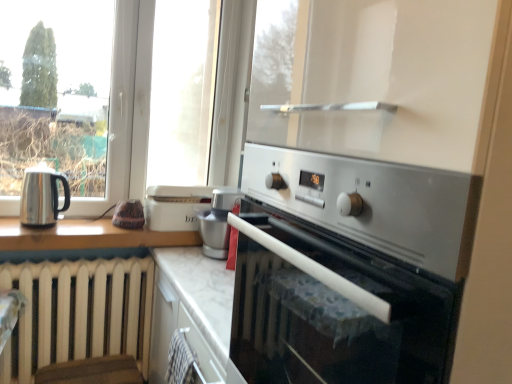
What is the approximate width of satin silver appliance at center?

The width of satin silver appliance at center is 11.31 inches.

Locate an element on the screen. This screenshot has width=512, height=384. shiny metallic kettle at left is located at coordinates (42, 197).

What do you see at coordinates (350, 269) in the screenshot? I see `satin silver oven at center` at bounding box center [350, 269].

Where is `satin silver appliance at center`? Image resolution: width=512 pixels, height=384 pixels. satin silver appliance at center is located at coordinates (218, 222).

In the scene shown: Would you say shiny metallic kettle at left is a long distance from satin silver appliance at center?

shiny metallic kettle at left is actually quite close to satin silver appliance at center.

Is shiny metallic kettle at left facing away from satin silver appliance at center?

No, shiny metallic kettle at left is not facing away from satin silver appliance at center.

What's the angular difference between shiny metallic kettle at left and satin silver appliance at center's facing directions?

The angular difference between shiny metallic kettle at left and satin silver appliance at center is 90 degrees.

Which object is closer to the camera taking this photo, satin silver appliance at center or shiny metallic kettle at left?

shiny metallic kettle at left.

From the picture: Is satin silver appliance at center positioned beyond the bounds of shiny metallic kettle at left?

Yes, satin silver appliance at center is outside of shiny metallic kettle at left.

Does satin silver appliance at center have a smaller size compared to shiny metallic kettle at left?

Actually, satin silver appliance at center might be larger than shiny metallic kettle at left.

Find the location of a particular element. The image size is (512, 384). appliance that is on the left side of satin silver oven at center is located at coordinates (218, 222).

Is point (246, 207) closer or farther from the camera than point (222, 258)?

Clearly, point (246, 207) is closer to the camera than point (222, 258).

Looking at this image, based on their sizes in the image, would you say satin silver oven at center is bigger or smaller than satin silver appliance at center?

In the image, satin silver oven at center appears to be larger than satin silver appliance at center.

From a real-world perspective, is shiny metallic kettle at left below satin silver oven at center?

Correct, in the physical world, shiny metallic kettle at left is lower than satin silver oven at center.

Consider the image. Considering the relative positions of shiny metallic kettle at left and satin silver oven at center in the image provided, is shiny metallic kettle at left to the left of satin silver oven at center from the viewer's perspective?

Yes.

Considering the relative sizes of shiny metallic kettle at left and satin silver oven at center in the image provided, is shiny metallic kettle at left wider than satin silver oven at center?

No.

Considering the sizes of objects satin silver appliance at center and satin silver oven at center in the image provided, who is thinner, satin silver appliance at center or satin silver oven at center?

With smaller width is satin silver appliance at center.

How different are the orientations of satin silver appliance at center and satin silver oven at center in degrees?

1.58 degrees separate the facing orientations of satin silver appliance at center and satin silver oven at center.

From the image's perspective, which one is positioned higher, satin silver appliance at center or satin silver oven at center?

satin silver appliance at center, from the image's perspective.

Considering the relative positions of satin silver appliance at center and satin silver oven at center in the image provided, is satin silver appliance at center to the right of satin silver oven at center from the viewer's perspective?

In fact, satin silver appliance at center is to the left of satin silver oven at center.

Considering the sizes of satin silver oven at center and shiny metallic kettle at left in the image, is satin silver oven at center wider or thinner than shiny metallic kettle at left?

In the image, satin silver oven at center appears to be wider than shiny metallic kettle at left.

Based on the photo, is satin silver oven at center aimed at shiny metallic kettle at left?

No, satin silver oven at center is not oriented towards shiny metallic kettle at left.

Which object is further away from the camera taking this photo, satin silver oven at center or shiny metallic kettle at left?

shiny metallic kettle at left.

Between satin silver oven at center and shiny metallic kettle at left, which one has larger size?

satin silver oven at center is bigger.

Locate an element on the screen. The width and height of the screenshot is (512, 384). appliance on the right side of shiny metallic kettle at left is located at coordinates (218, 222).

Where is `kitchen appliance above the satin silver appliance at center (from the image's perspective)`? This screenshot has width=512, height=384. kitchen appliance above the satin silver appliance at center (from the image's perspective) is located at coordinates (42, 197).

Estimate the real-world distances between objects in this image. Which object is further from shiny metallic kettle at left, satin silver appliance at center or satin silver oven at center?

satin silver oven at center is further to shiny metallic kettle at left.

From the image, which object appears to be nearer to shiny metallic kettle at left, satin silver oven at center or satin silver appliance at center?

The object closer to shiny metallic kettle at left is satin silver appliance at center.

Based on the photo, when comparing their distances from satin silver appliance at center, does satin silver oven at center or shiny metallic kettle at left seem closer?

shiny metallic kettle at left.

From the image, which object appears to be farther from satin silver appliance at center, shiny metallic kettle at left or satin silver oven at center?

satin silver oven at center.

From the image, which object appears to be nearer to satin silver oven at center, shiny metallic kettle at left or satin silver appliance at center?

Among the two, satin silver appliance at center is located nearer to satin silver oven at center.

Based on their spatial positions, is satin silver appliance at center or shiny metallic kettle at left further from satin silver oven at center?

shiny metallic kettle at left lies further to satin silver oven at center than the other object.

Where is `kitchen appliance positioned between satin silver oven at center and satin silver appliance at center from near to far`? kitchen appliance positioned between satin silver oven at center and satin silver appliance at center from near to far is located at coordinates (42, 197).